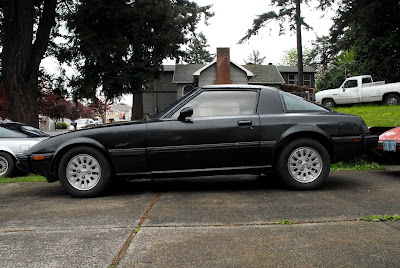
This screenshot has width=400, height=268. Identify the location of chimney. (224, 70).